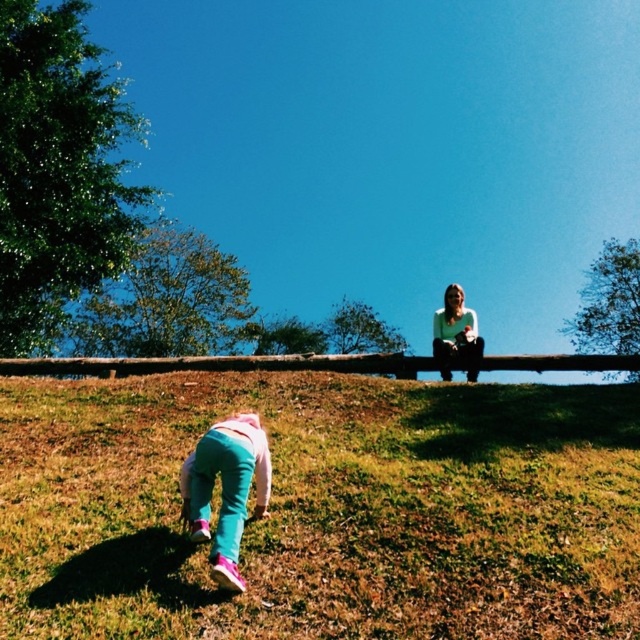
You are a photographer trying to capture the scene. You notice the teal fabric pants at lower left and the white matte shirt at upper center. Which object should you focus on first if you want to ensure both are in sharp focus?

You should focus on the teal fabric pants at lower left first because it is closer to you than the white matte shirt at upper center, so focusing on the closer object will keep both in focus when using a shallow depth of field.

You are standing at the center of the image and want to move towards the teal fabric pants at lower left. Which direction should you move in?

You should move towards the lower left direction to reach the teal fabric pants at lower left.